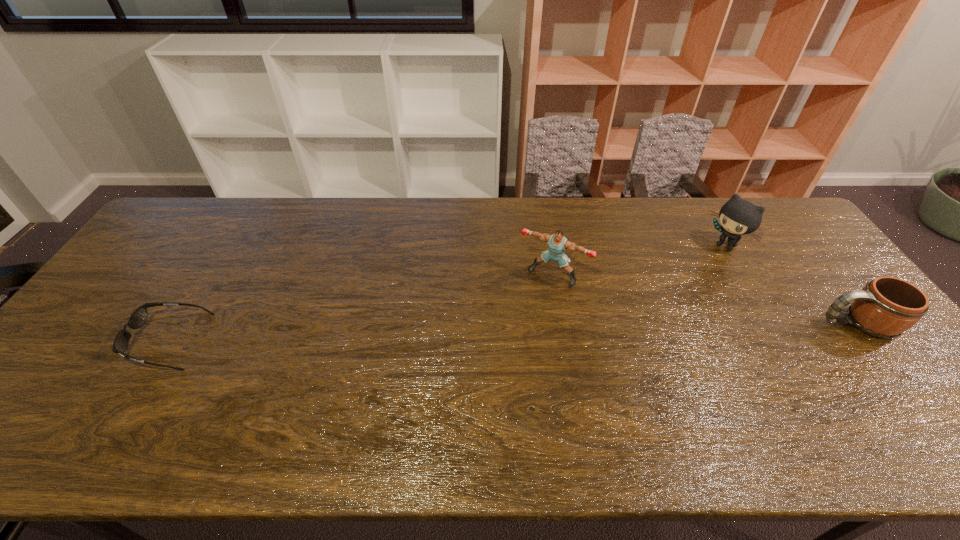
Identify the location of vacant area that lies between the rightmost object and the kitten. (791, 285).

Identify the location of vacant point located between the second object from right to left and the sunglasses. The width and height of the screenshot is (960, 540). (447, 294).

Identify the location of vacant space that is in between the second farthest object and the third object from left to right. (638, 261).

This screenshot has width=960, height=540. In order to click on vacant area that lies between the second farthest object and the second shortest object in this screenshot , I will do `click(705, 300)`.

Find the location of `free space between the shortest object and the rightmost object`. free space between the shortest object and the rightmost object is located at coordinates (514, 332).

Image resolution: width=960 pixels, height=540 pixels. Identify the location of free space between the third tallest object and the third object from right to left. (705, 300).

Locate which object ranks third in proximity to the shortest object. Please provide its 2D coordinates. Your answer should be formatted as a tuple, i.e. [(x, y)], where the tuple contains the x and y coordinates of a point satisfying the conditions above.

[(886, 307)]

Select which object appears as the second closest to the third tallest object. Please provide its 2D coordinates. Your answer should be formatted as a tuple, i.e. [(x, y)], where the tuple contains the x and y coordinates of a point satisfying the conditions above.

[(557, 243)]

Where is `free space that satisfies the following two spatial constraints: 1. on the back side of the puncher; 2. on the right side of the farthest object`? free space that satisfies the following two spatial constraints: 1. on the back side of the puncher; 2. on the right side of the farthest object is located at coordinates (547, 247).

Where is `free space that satisfies the following two spatial constraints: 1. on the front side of the rightmost object; 2. on the side of the puncher with the handle`? This screenshot has width=960, height=540. free space that satisfies the following two spatial constraints: 1. on the front side of the rightmost object; 2. on the side of the puncher with the handle is located at coordinates (561, 323).